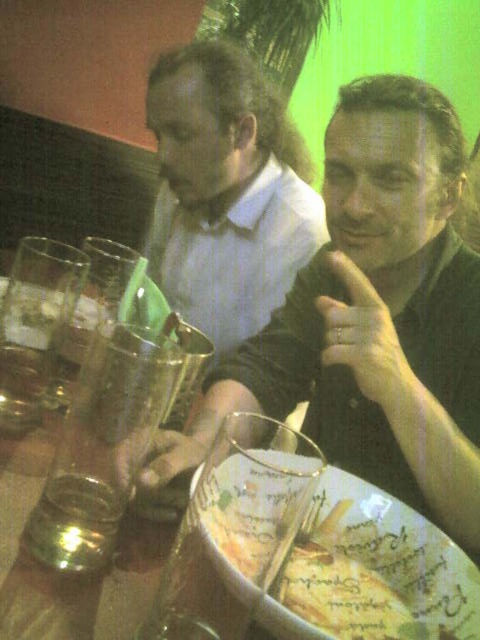
Is matte black shirt at center to the left of decorative ceramic plate at center from the viewer's perspective?

In fact, matte black shirt at center is to the right of decorative ceramic plate at center.

Is point (320, 320) closer to camera compared to point (365, 499)?

That is False.

This screenshot has height=640, width=480. I want to click on matte black shirt at center, so [x=373, y=317].

Which of these two, matte white shirt at center or shiny metallic glass at table center, stands taller?

matte white shirt at center

This screenshot has height=640, width=480. What do you see at coordinates (227, 192) in the screenshot?
I see `matte white shirt at center` at bounding box center [227, 192].

The height and width of the screenshot is (640, 480). What do you see at coordinates (227, 192) in the screenshot?
I see `matte white shirt at center` at bounding box center [227, 192].

Locate an element on the screen. The width and height of the screenshot is (480, 640). matte white shirt at center is located at coordinates (227, 192).

Is point (288, 360) less distant than point (69, 499)?

No, (288, 360) is further to viewer.

Based on the photo, who is more distant from viewer, (444, 360) or (41, 490)?

Point (444, 360)

Does point (408, 417) come closer to viewer compared to point (107, 483)?

No.

You are a GUI agent. You are given a task and a screenshot of the screen. Output one action in this format:
    pyautogui.click(x=<x>, y=<y>)
    Task: Click on the matte black shirt at center
    The height and width of the screenshot is (640, 480).
    Given the screenshot: What is the action you would take?
    pyautogui.click(x=373, y=317)